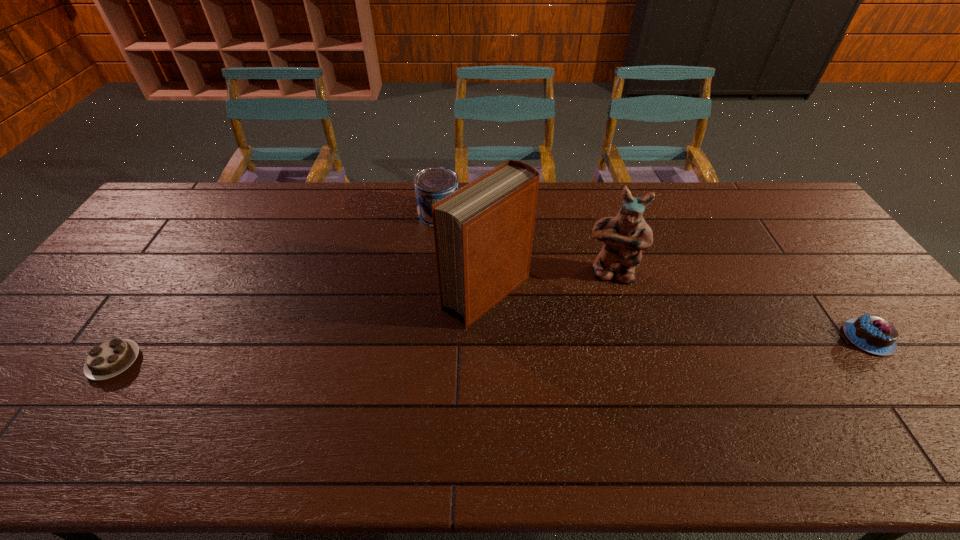
What are the coordinates of `the shorter chocolate cake` in the screenshot? It's located at (111, 358).

The image size is (960, 540). Find the location of `the shortest object`. the shortest object is located at coordinates (111, 358).

The image size is (960, 540). I want to click on the right chocolate cake, so click(x=873, y=334).

The width and height of the screenshot is (960, 540). I want to click on the taller chocolate cake, so pyautogui.click(x=873, y=334).

Identify the location of the farthest object. (431, 184).

At what (x,y) coordinates should I click in order to perform the action: click on can. Please return your answer as a coordinate pair (x, y). Looking at the image, I should click on (431, 184).

Where is `the second object from right to left`? the second object from right to left is located at coordinates (625, 236).

At what (x,y) coordinates should I click in order to perform the action: click on the second tallest object. Please return your answer as a coordinate pair (x, y). This screenshot has width=960, height=540. Looking at the image, I should click on (625, 236).

Where is `hardback book`? Image resolution: width=960 pixels, height=540 pixels. hardback book is located at coordinates (483, 232).

Identify the location of vacant point located 0.140m on the right of the shorter chocolate cake. (195, 362).